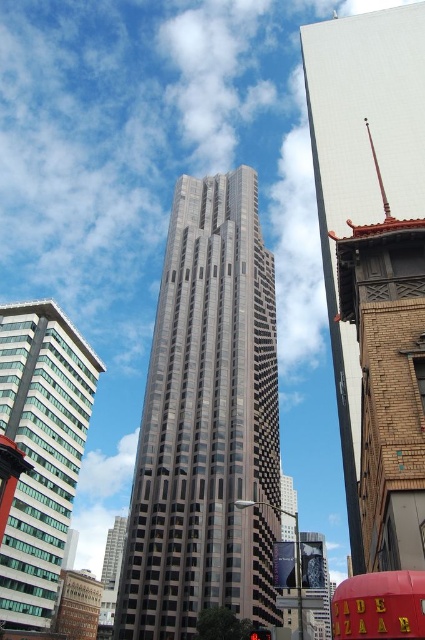
You are a photographer planning to capture the shiny glass skyscraper at center and the red inflatable sign at center in a single shot. Based on their positions, which object should you focus on first to ensure both are in frame?

The shiny glass skyscraper at center is above the red inflatable sign at center, so you should focus on the red inflatable sign at center first to ensure both are in frame.

You are a drone operator trying to capture a photo of the glassy steel skyscraper at center and the red inflatable sign at center. From your current position, which object is positioned higher in the frame?

The glassy steel skyscraper at center is located above the red inflatable sign at center, so it is positioned higher in the frame.